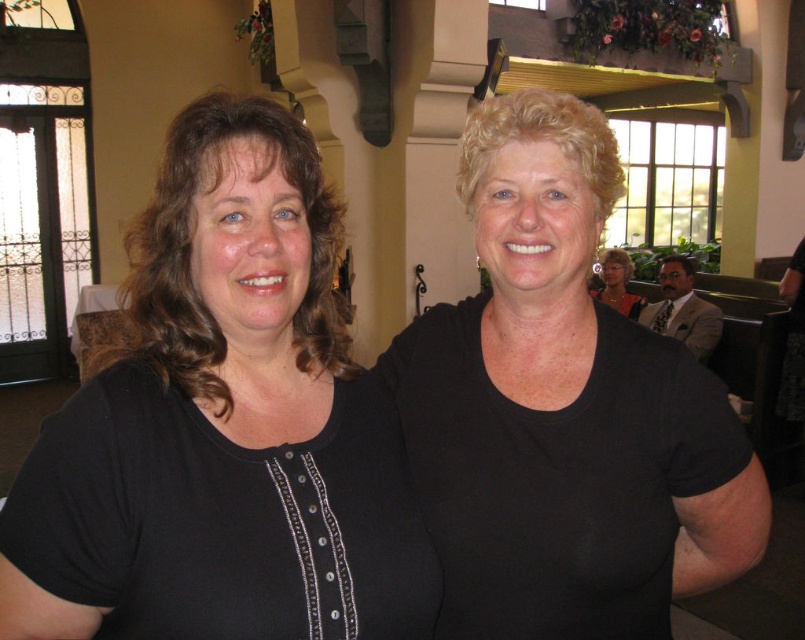
Question: Which object appears closest to the camera in this image?

Choices:
 (A) black knit shirt at center
 (B) matte black shirt at center

Answer: (A)

Question: Does black knit shirt at center appear on the right side of black matte shirt at upper right?

Choices:
 (A) no
 (B) yes

Answer: (A)

Question: Based on their relative distances, which object is nearer to the matte black shirt at center?

Choices:
 (A) black matte shirt at upper right
 (B) black knit shirt at center

Answer: (A)

Question: Considering the relative positions of black matte shirt at upper right and matte black shirt at center in the image provided, where is black matte shirt at upper right located with respect to matte black shirt at center?

Choices:
 (A) left
 (B) right

Answer: (A)

Question: Is black knit shirt at center wider than black matte shirt at upper right?

Choices:
 (A) no
 (B) yes

Answer: (A)

Question: Based on their relative distances, which object is farther from the black matte shirt at upper right?

Choices:
 (A) black knit shirt at center
 (B) matte black shirt at center

Answer: (B)